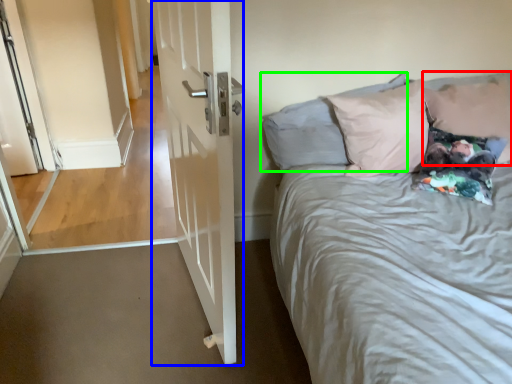
Question: Estimate the real-world distances between objects in this image. Which object is closer to pillow (highlighted by a red box), door (highlighted by a blue box) or pillow (highlighted by a green box)?

Choices:
 (A) door
 (B) pillow

Answer: (B)